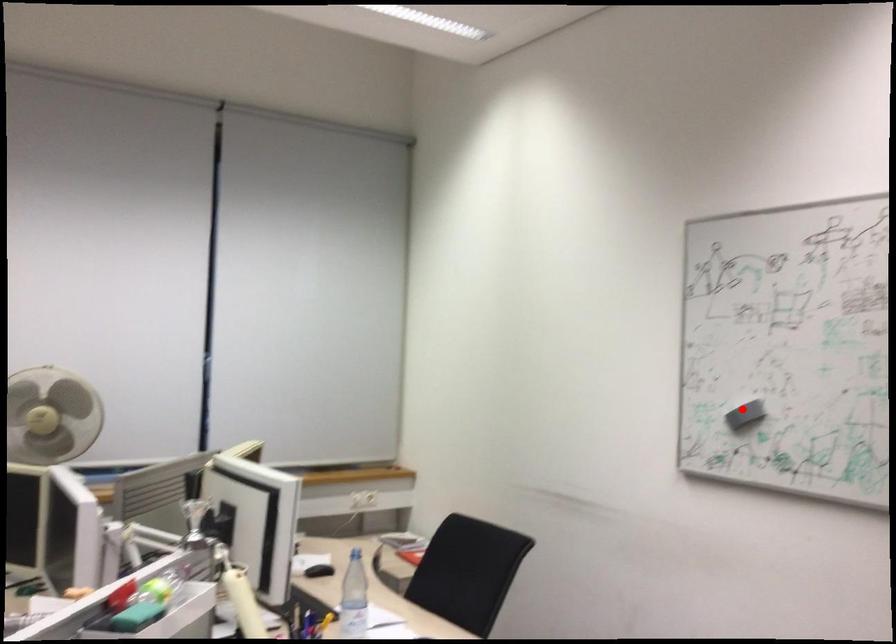
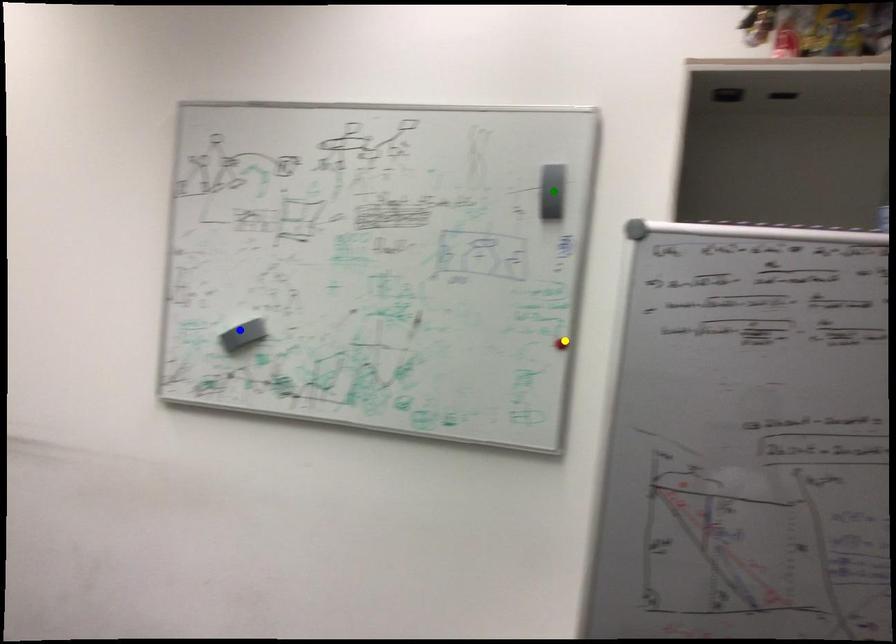
Question: I am providing you with two images of the same scene from different viewpoints. A red point is marked on the first image. You are given multiple points on the second image. Which point in image 2 represents the same 3d spot as the red point in image 1?

Choices:
 (A) yellow point
 (B) blue point
 (C) green point

Answer: (B)